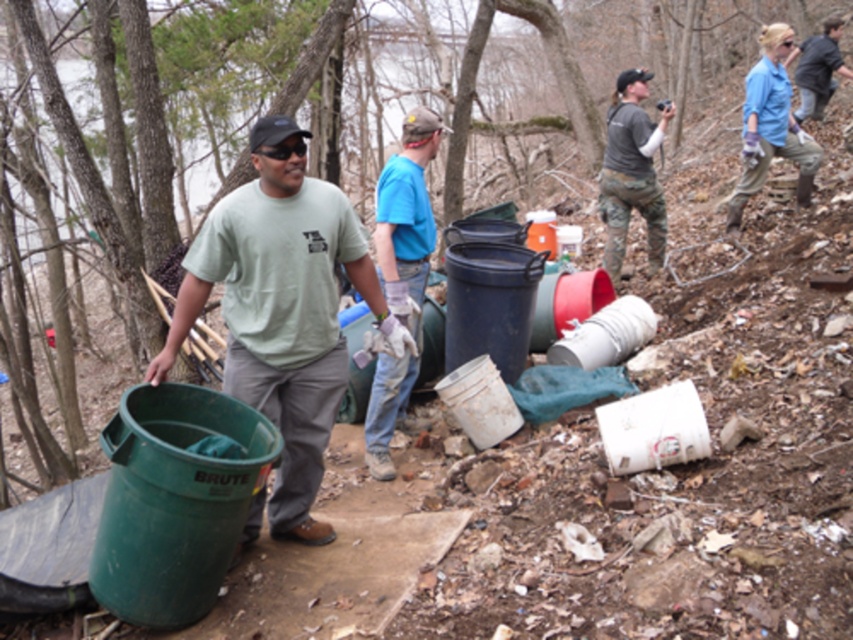
Looking at this image, can you confirm if green matte bucket at left is smaller than dark gray jacket at upper right?

Yes, green matte bucket at left is smaller than dark gray jacket at upper right.

Is green matte bucket at left above dark gray jacket at upper right?

Incorrect, green matte bucket at left is not positioned above dark gray jacket at upper right.

Is point (283, 195) behind point (814, 115)?

No, (283, 195) is in front of (814, 115).

Locate an element on the screen. The width and height of the screenshot is (853, 640). green matte bucket at left is located at coordinates (282, 308).

Can you confirm if blue fabric shirt at center is positioned to the right of dark gray jacket at upper right?

Incorrect, blue fabric shirt at center is not on the right side of dark gray jacket at upper right.

Which is behind, point (372, 449) or point (801, 42)?

Positioned behind is point (801, 42).

Locate an element on the screen. The image size is (853, 640). blue fabric shirt at center is located at coordinates point(407,218).

At what (x,y) coordinates should I click in order to perform the action: click on green matte bucket at left. Please return your answer as a coordinate pair (x, y). Looking at the image, I should click on (282, 308).

Is green matte bucket at left above blue cotton shirt at upper right?

No, green matte bucket at left is not above blue cotton shirt at upper right.

What do you see at coordinates (282, 308) in the screenshot? I see `green matte bucket at left` at bounding box center [282, 308].

I want to click on green matte bucket at left, so click(x=282, y=308).